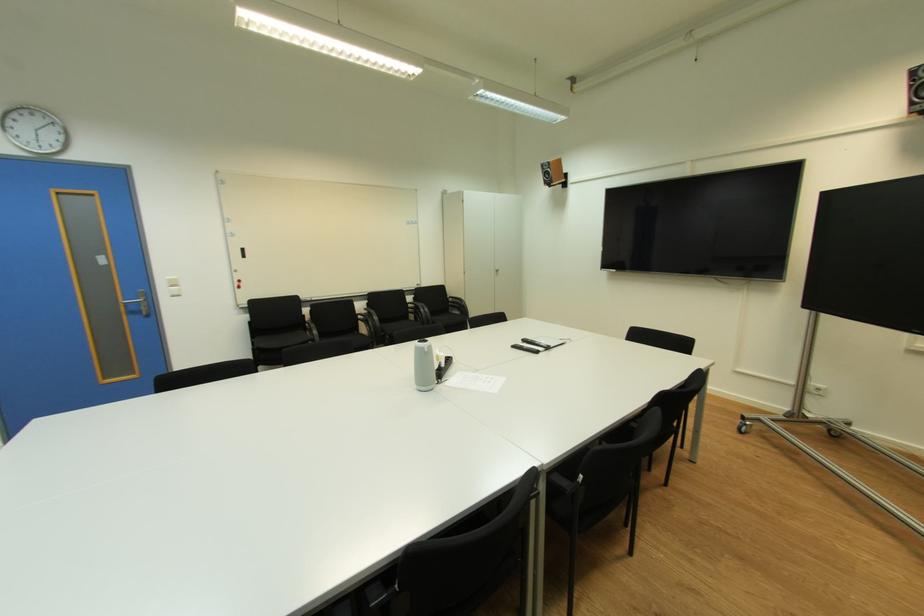
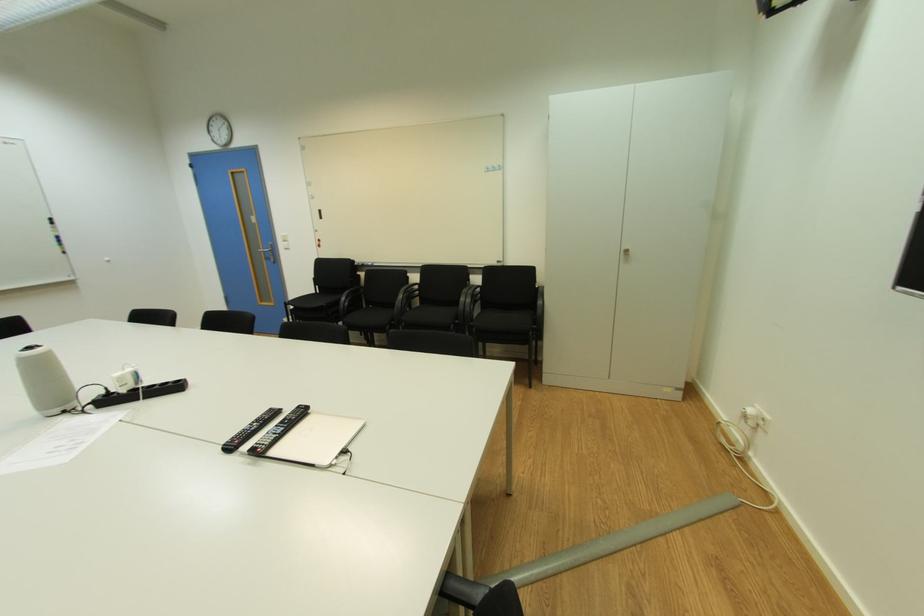
Find the pixel in the second image that matches (x=138, y=313) in the first image.

(274, 260)